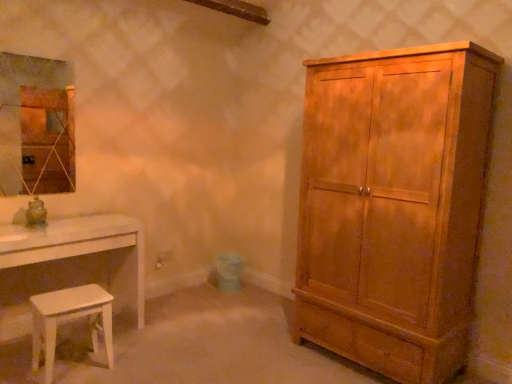
In order to click on empty space that is ontop of white glossy stool at lower left in this screenshot , I will do `click(74, 293)`.